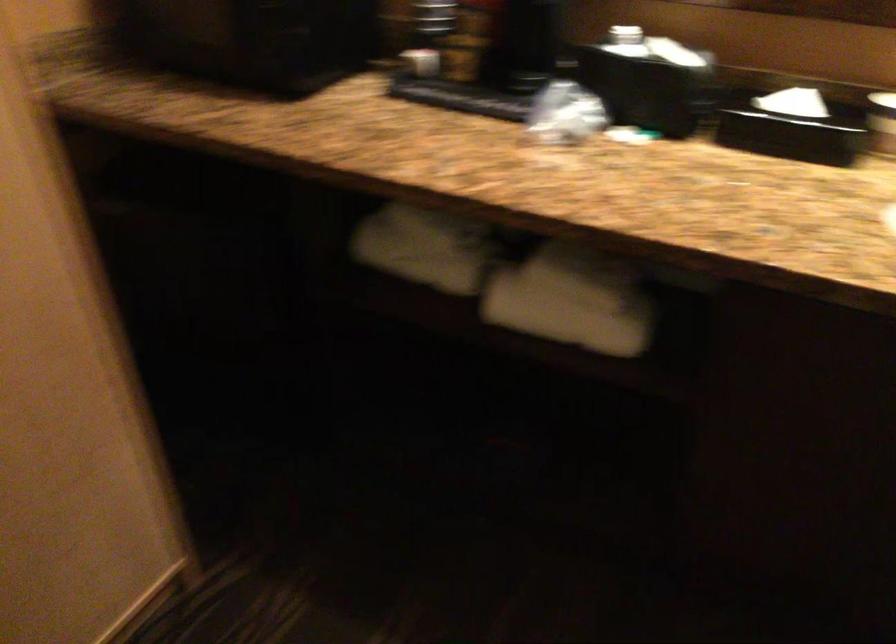
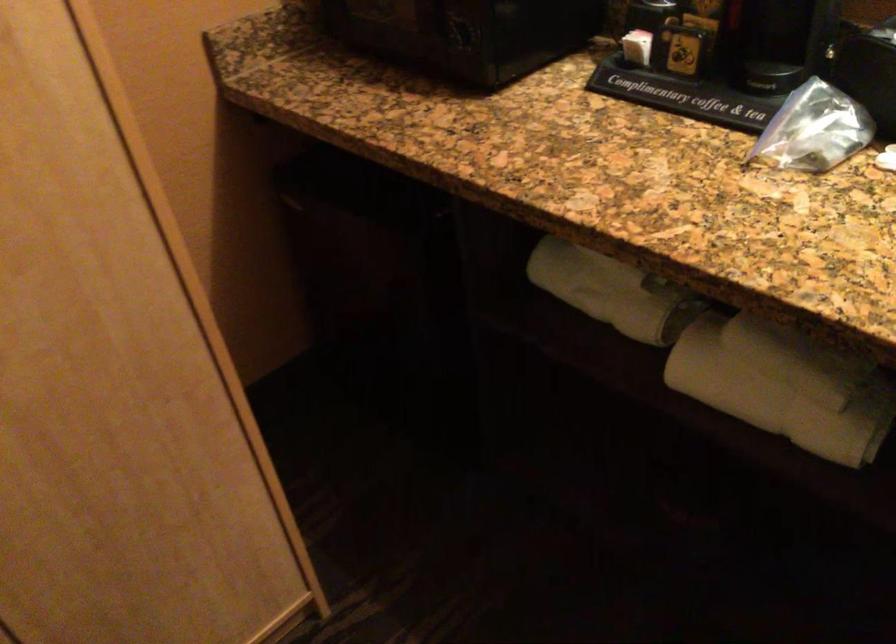
Locate, in the second image, the point that corresponds to point (570, 111) in the first image.

(814, 129)